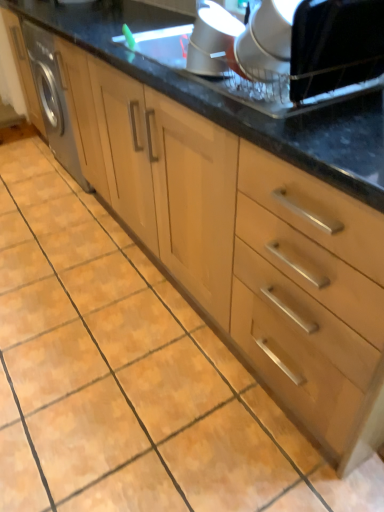
This screenshot has width=384, height=512. Identify the location of free location in front of black fabric at upper right, which appears as the 1th appliance when viewed from the right. (339, 127).